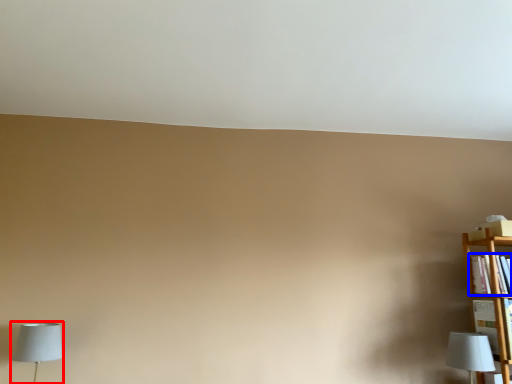
Question: Which of the following is the closest to the observer, lamp (highlighted by a red box) or book (highlighted by a blue box)?

Choices:
 (A) lamp
 (B) book

Answer: (A)